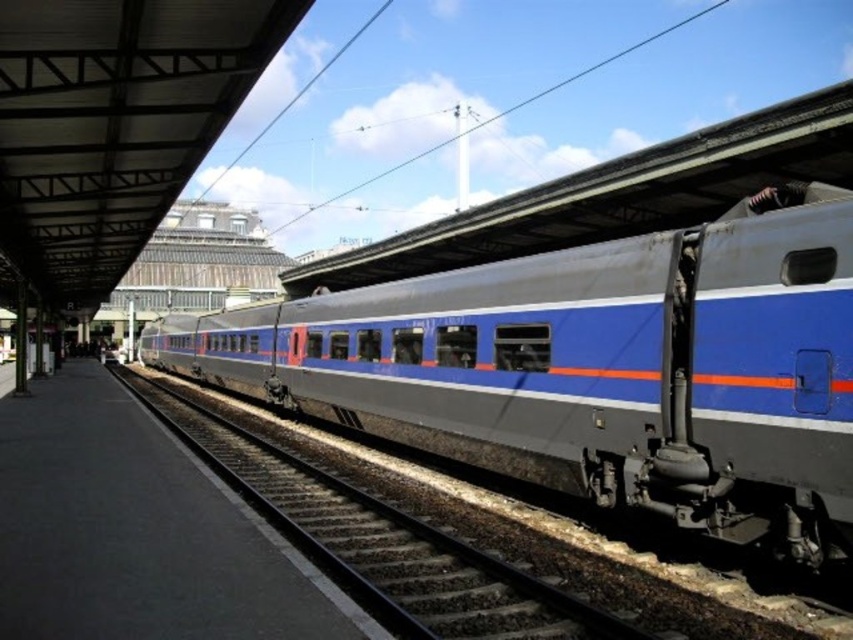
You are standing at the train station and want to take a photo of the metallic blue train at center. If your camera is 5 feet wide, can you fit the entire train into the frame without moving closer?

→ The metallic blue train at center and camera are 18.25 feet apart from each other. Since the camera is 5 feet wide, the distance between them is more than enough to fit the entire train into the frame without needing to move closer.

You are standing at the point marked by the coordinates point [595,369] on the platform. What object is directly beneath you?

The point [595,369] marks the metallic blue train at center, so the object directly beneath you is the metallic blue train at center.

You are a maintenance worker checking the train station. You need to inspect the metallic blue train at center and the metal train track at center. According to the scene, which object is positioned higher in elevation?

The metallic blue train at center is located above the metal train track at center, so it is positioned higher in elevation.